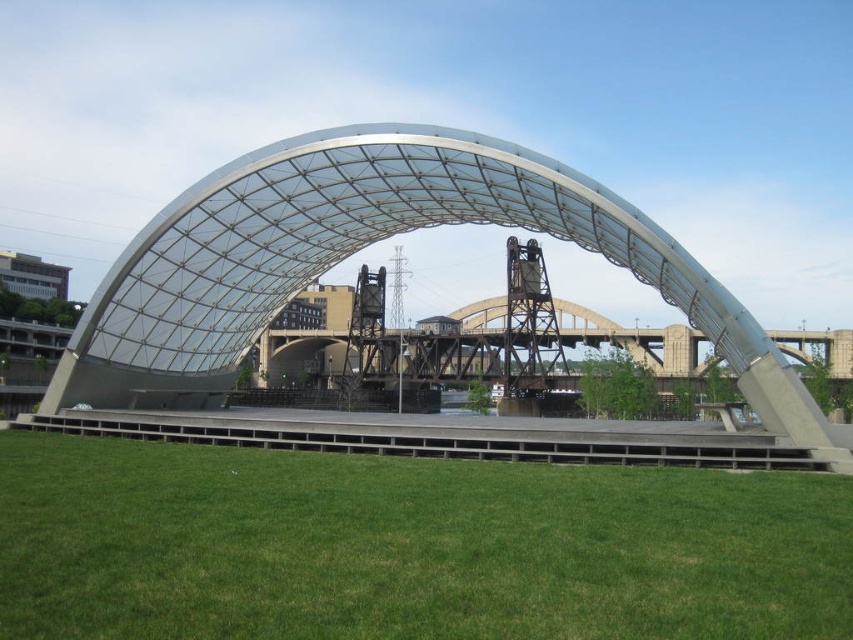
Is green grass at lower center to the right of transparent glass dome at center from the viewer's perspective?

Yes, green grass at lower center is to the right of transparent glass dome at center.

Is point (474, 564) in front of point (61, 378)?

Yes.

Is point (283, 458) more distant than point (125, 266)?

No, (283, 458) is in front of (125, 266).

You are a GUI agent. You are given a task and a screenshot of the screen. Output one action in this format:
    pyautogui.click(x=<x>, y=<y>)
    Task: Click on the green grass at lower center
    
    Given the screenshot: What is the action you would take?
    pyautogui.click(x=408, y=547)